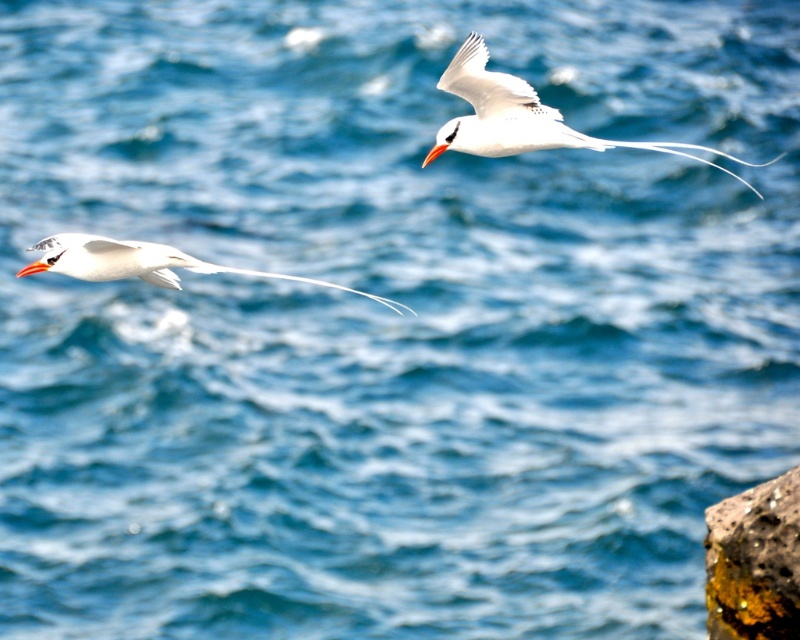
Between rusty stone at lower right and orange glossy beak at upper left, which one appears on the right side from the viewer's perspective?

From the viewer's perspective, rusty stone at lower right appears more on the right side.

Describe the element at coordinates (754, 561) in the screenshot. Image resolution: width=800 pixels, height=640 pixels. I see `rusty stone at lower right` at that location.

What are the coordinates of `rusty stone at lower right` in the screenshot? It's located at pyautogui.click(x=754, y=561).

Is white glossy bird at left closer to camera compared to orange glossy beak at upper left?

Yes, white glossy bird at left is closer to the viewer.

Between point (84, 243) and point (30, 269), which one is positioned behind?

The point (84, 243) is more distant.

At what (x,y) coordinates should I click in order to perform the action: click on white glossy bird at left. Please return your answer as a coordinate pair (x, y). Looking at the image, I should click on (145, 262).

Who is higher up, rusty stone at lower right or orange glossy beak at upper right?

orange glossy beak at upper right is above.

Which is below, rusty stone at lower right or orange glossy beak at upper right?

rusty stone at lower right is lower down.

Identify the location of rusty stone at lower right. (754, 561).

Where is `rusty stone at lower right`? Image resolution: width=800 pixels, height=640 pixels. rusty stone at lower right is located at coordinates click(x=754, y=561).